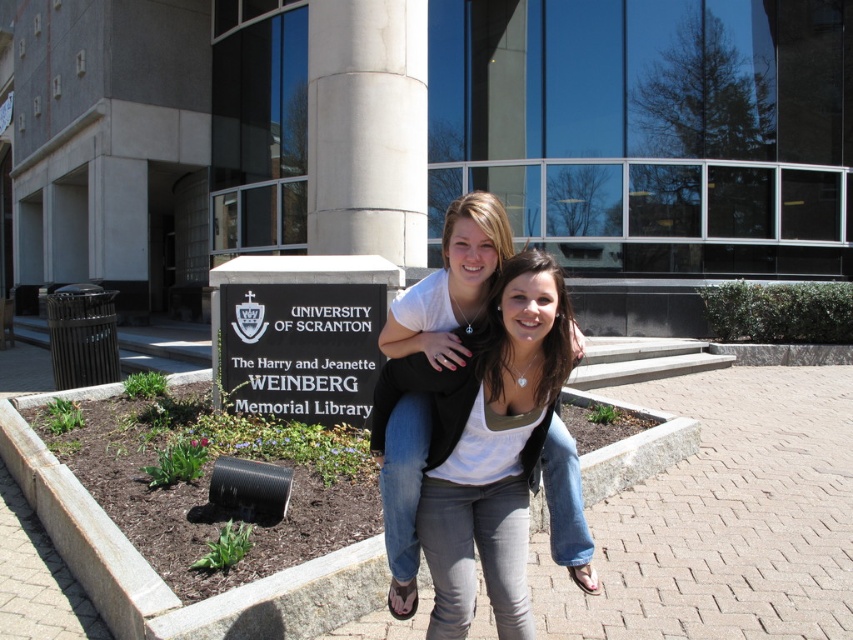
Question: Does white matte shirt at center lie in front of white concrete pillar at center?

Choices:
 (A) yes
 (B) no

Answer: (A)

Question: Which of the following is the farthest from the observer?

Choices:
 (A) (363, 35)
 (B) (245, 323)
 (C) (404, 378)

Answer: (A)

Question: Which point is farther from the camera taking this photo?

Choices:
 (A) (270, 380)
 (B) (318, 230)
 (C) (451, 620)

Answer: (B)

Question: From the image, what is the correct spatial relationship of white matte shirt at center in relation to black plastic sign at center?

Choices:
 (A) left
 (B) right

Answer: (B)

Question: Which point appears farthest from the camera in this image?

Choices:
 (A) (312, 76)
 (B) (566, 326)
 (C) (312, 410)

Answer: (A)

Question: Where is white matte shirt at center located in relation to black plastic sign at center in the image?

Choices:
 (A) above
 (B) below

Answer: (B)